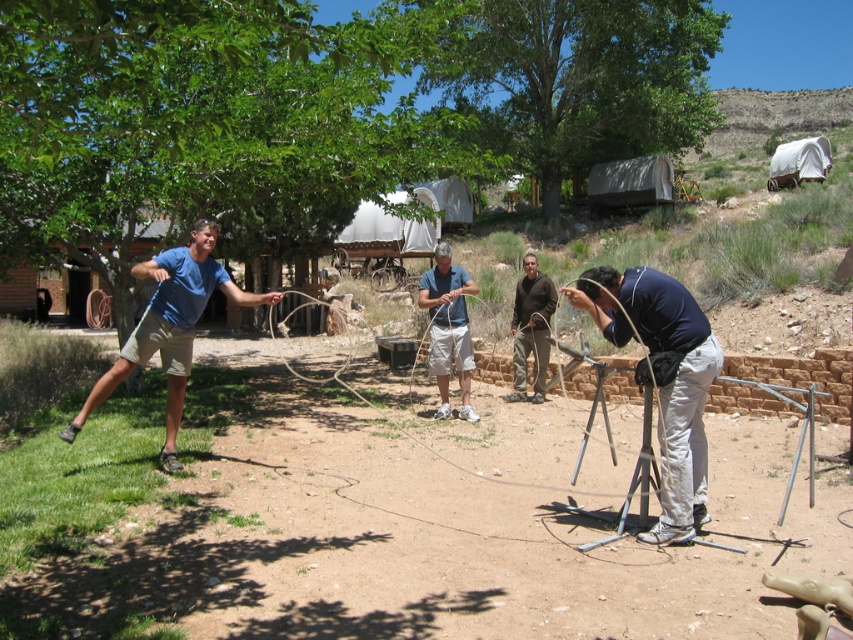
Who is higher up, blue cotton shirt at left or brown cotton pants at center?

brown cotton pants at center is above.

Which is in front, point (189, 273) or point (544, 365)?

Point (189, 273)

Does point (144, 320) come behind point (531, 330)?

That is False.

Locate an element on the screen. The image size is (853, 640). blue cotton shirt at left is located at coordinates (170, 326).

Is point (671, 538) behind point (525, 298)?

No.

Locate an element on the screen. The image size is (853, 640). dark blue fabric at center is located at coordinates (664, 378).

Measure the distance from blue cotton shirt at left to matte blue shirt at center.

The distance of blue cotton shirt at left from matte blue shirt at center is 3.25 meters.

Which is behind, point (189, 323) or point (444, 362)?

Point (444, 362)

Which is behind, point (160, 456) or point (431, 340)?

Positioned behind is point (431, 340).

Identify the location of blue cotton shirt at left. The height and width of the screenshot is (640, 853). (170, 326).